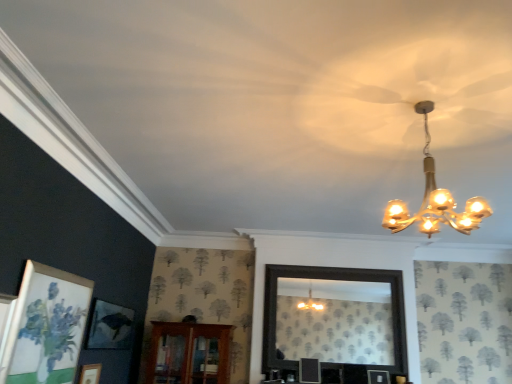
Question: Considering the relative sizes of matte white picture frame at lower left and gold glass chandelier at upper right in the image provided, is matte white picture frame at lower left bigger than gold glass chandelier at upper right?

Choices:
 (A) yes
 (B) no

Answer: (B)

Question: Can you see matte white picture frame at lower left touching gold glass chandelier at upper right?

Choices:
 (A) no
 (B) yes

Answer: (A)

Question: Is matte white picture frame at lower left not close to gold glass chandelier at upper right?

Choices:
 (A) yes
 (B) no

Answer: (A)

Question: Can you confirm if matte white picture frame at lower left is thinner than gold glass chandelier at upper right?

Choices:
 (A) no
 (B) yes

Answer: (B)

Question: From the image's perspective, is matte white picture frame at lower left located above gold glass chandelier at upper right?

Choices:
 (A) yes
 (B) no

Answer: (B)

Question: Is matte white picture frame at lower left smaller than gold glass chandelier at upper right?

Choices:
 (A) yes
 (B) no

Answer: (A)

Question: From the image's perspective, is brown wooden cabinet at center on top of gold glass chandelier at upper right?

Choices:
 (A) no
 (B) yes

Answer: (A)

Question: From the image's perspective, is brown wooden cabinet at center located beneath gold glass chandelier at upper right?

Choices:
 (A) yes
 (B) no

Answer: (A)

Question: Is brown wooden cabinet at center positioned before gold glass chandelier at upper right?

Choices:
 (A) no
 (B) yes

Answer: (A)

Question: Is brown wooden cabinet at center taller than gold glass chandelier at upper right?

Choices:
 (A) yes
 (B) no

Answer: (A)

Question: Is brown wooden cabinet at center looking in the opposite direction of gold glass chandelier at upper right?

Choices:
 (A) yes
 (B) no

Answer: (B)

Question: Is brown wooden cabinet at center placed right next to gold glass chandelier at upper right?

Choices:
 (A) no
 (B) yes

Answer: (A)

Question: Can you confirm if gold glass chandelier at upper right is positioned to the right of matte white picture frame at lower left?

Choices:
 (A) no
 (B) yes

Answer: (B)